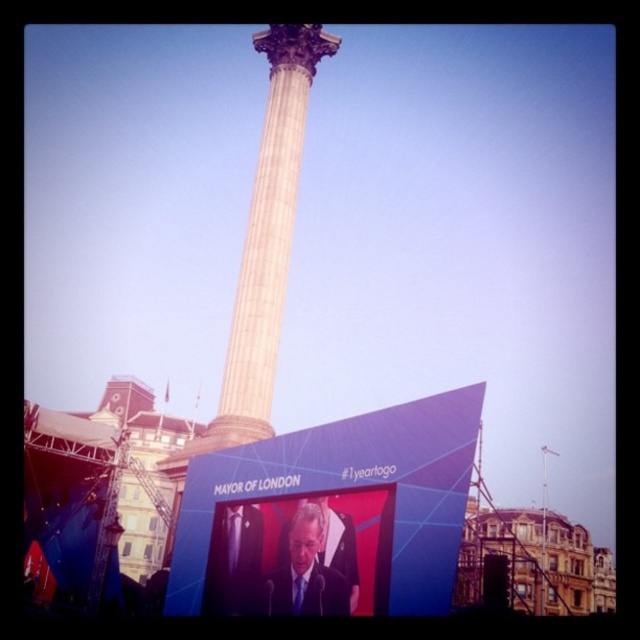
You are standing in Trafalgar Square and want to take a photo of the monument. If you move 10 meters closer to the monument, will the point at coordinates point (268,358) be within your camera frame?

The point at coordinates point (268,358) is currently 57.75 meters from the camera. Moving 10 meters closer would reduce the distance to 47.75 meters. Since the camera frame typically includes objects within a certain range, the point would still be within the frame after moving closer.

You are a photographer at Trafalgar Square and want to capture a photo of the dark suit at center without the white marble column at center blocking it. How should you adjust your camera position?

Move your camera position below the current angle so that the dark suit at center is no longer obscured by the white marble column at center.